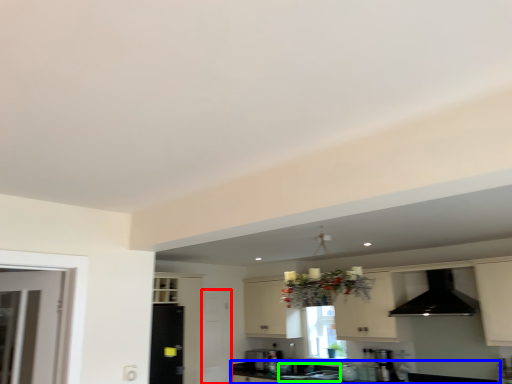
Question: Which object is the farthest from screen door (highlighted by a red box)? Choose among these: countertop (highlighted by a blue box) or sink (highlighted by a green box).

Choices:
 (A) countertop
 (B) sink

Answer: (B)